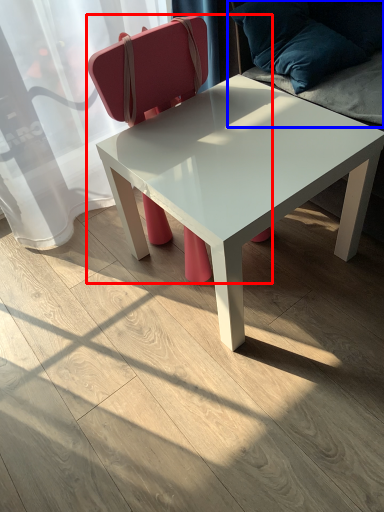
Question: Which object is closer to the camera taking this photo, chair (highlighted by a red box) or swivel chair (highlighted by a blue box)?

Choices:
 (A) chair
 (B) swivel chair

Answer: (A)